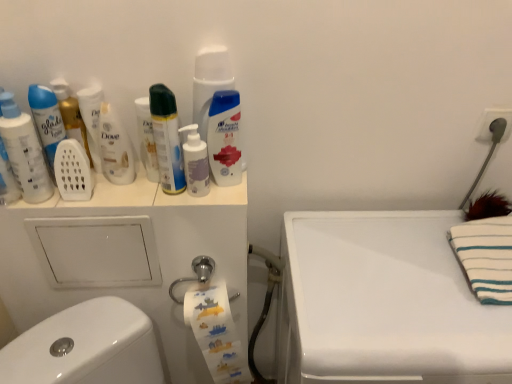
Question: In the image, is white striped towel at upper right positioned in front of or behind matte white mouthwash at left, arranged as the fifth mouthwash when viewed from the right?

Choices:
 (A) front
 (B) behind

Answer: (A)

Question: Considering the positions of point (458, 226) and point (62, 102), is point (458, 226) closer or farther from the camera than point (62, 102)?

Choices:
 (A) farther
 (B) closer

Answer: (A)

Question: Estimate the real-world distances between objects in this image. Which object is farther from the white glossy counter top at upper right?

Choices:
 (A) translucent plastic mouthwash at center, the fourth mouthwash in the left-to-right sequence
 (B) matte white mouthwash at left, the 1th mouthwash from the left
 (C) white striped towel at upper right
 (D) white matte plastic mouthwash at upper left, placed as the 3th mouthwash when sorted from left to right
 (E) matte white mouthwash at left, the second mouthwash positioned from the left

Answer: (B)

Question: Considering the real-world distances, which object is closest to the white striped towel at upper right?

Choices:
 (A) white matte pump bottle at center, the fifth mouthwash viewed from the left
 (B) translucent plastic mouthwash at center, positioned as the first mouthwash in right-to-left order
 (C) translucent plastic mouthwash at center, the 3th mouthwash positioned from the right
 (D) matte white mouthwash at left, arranged as the fifth mouthwash when viewed from the right
 (E) white glossy toilet paper at center

Answer: (B)